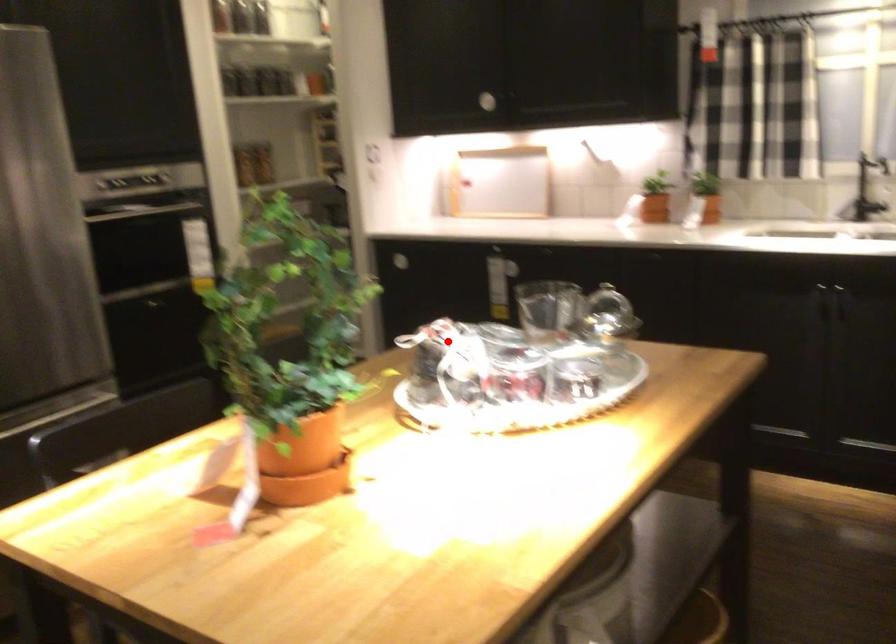
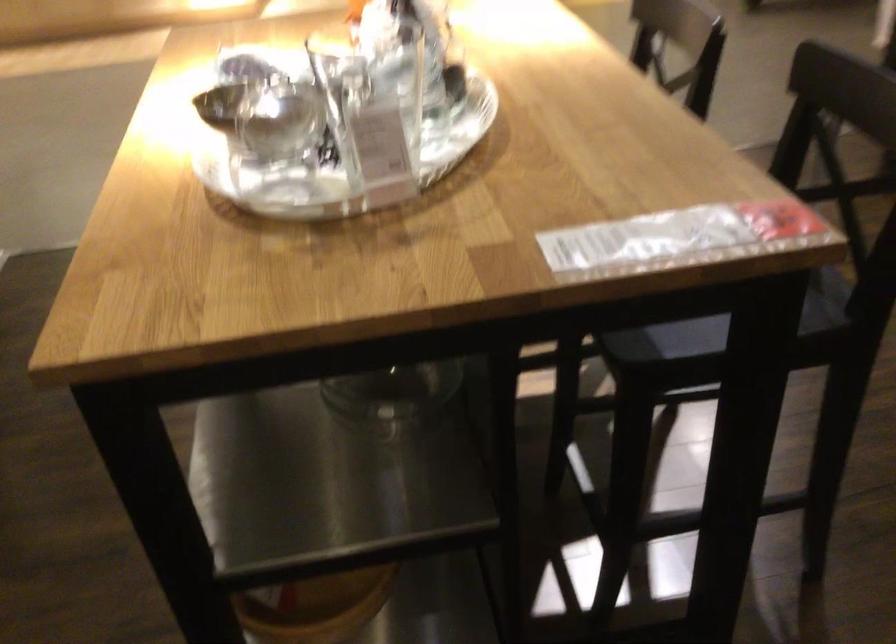
Where in the second image is the point corresponding to the highlighted location from the first image?

(371, 29)